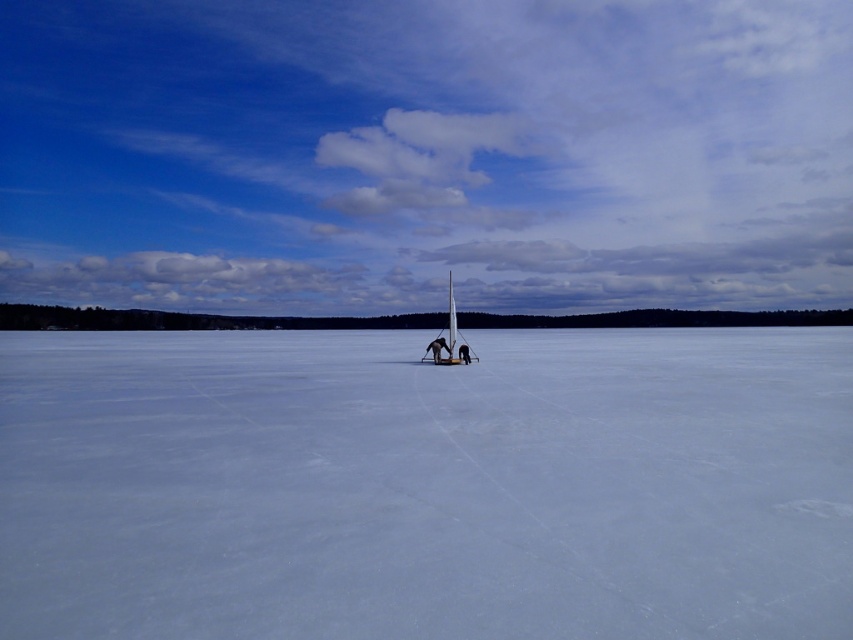
Question: Is white smooth ice at center to the right of white plastic sailboat at center from the viewer's perspective?

Choices:
 (A) no
 (B) yes

Answer: (A)

Question: Among these objects, which one is farthest from the camera?

Choices:
 (A) white plastic sailboat at center
 (B) white smooth ice at center

Answer: (A)

Question: Is white smooth ice at center below white plastic sailboat at center?

Choices:
 (A) no
 (B) yes

Answer: (B)

Question: Which point is farther to the camera?

Choices:
 (A) white plastic sailboat at center
 (B) white smooth ice at center

Answer: (A)

Question: Does white smooth ice at center appear on the left side of white plastic sailboat at center?

Choices:
 (A) yes
 (B) no

Answer: (A)